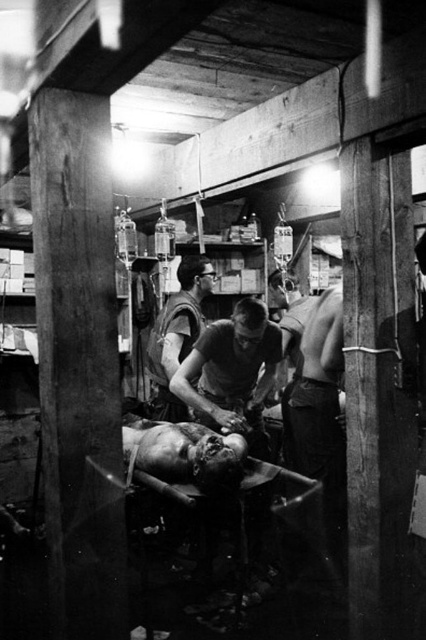
Can you confirm if smooth skin man at center is bigger than matte black vest at center?

Incorrect, smooth skin man at center is not larger than matte black vest at center.

Who is more distant from viewer, (287,392) or (150,339)?

Point (150,339)

Identify the location of smooth skin man at center. This screenshot has height=640, width=426. (314, 387).